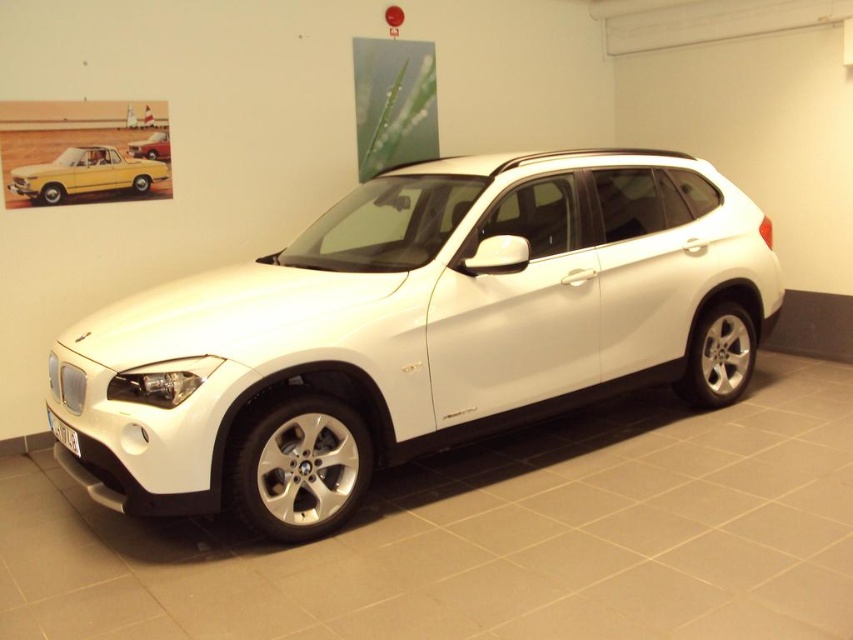
Question: Is white metallic car at center smaller than matte black car at upper left?

Choices:
 (A) no
 (B) yes

Answer: (A)

Question: Can you confirm if white metallic car at center is bigger than yellow matte vintage car at upper left?

Choices:
 (A) yes
 (B) no

Answer: (A)

Question: Which is farther from the yellow matte vintage car at upper left?

Choices:
 (A) white metallic car at center
 (B) matte black car at upper left

Answer: (A)

Question: Can you confirm if white metallic car at center is positioned to the right of yellow matte vintage car at upper left?

Choices:
 (A) no
 (B) yes

Answer: (B)

Question: Which point is farther from the camera taking this photo?

Choices:
 (A) (128, 147)
 (B) (160, 179)

Answer: (B)

Question: Which is nearer to the yellow matte vintage car at upper left?

Choices:
 (A) white metallic car at center
 (B) matte black car at upper left

Answer: (B)